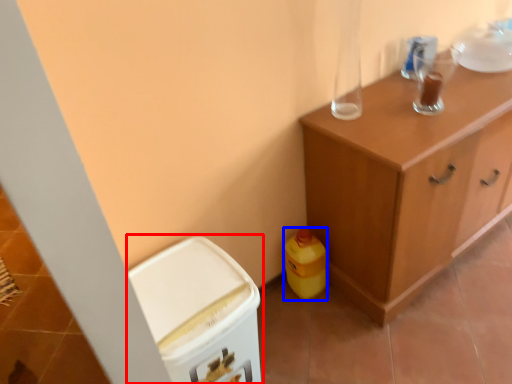
Question: Which point is closer to the camera, cabinetry (highlighted by a red box) or cleaning product (highlighted by a blue box)?

Choices:
 (A) cabinetry
 (B) cleaning product

Answer: (A)